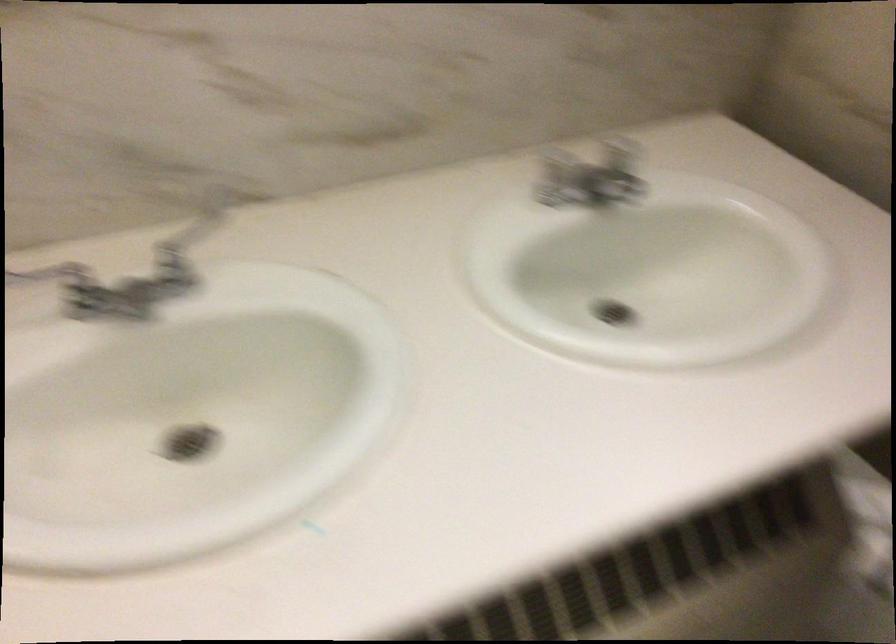
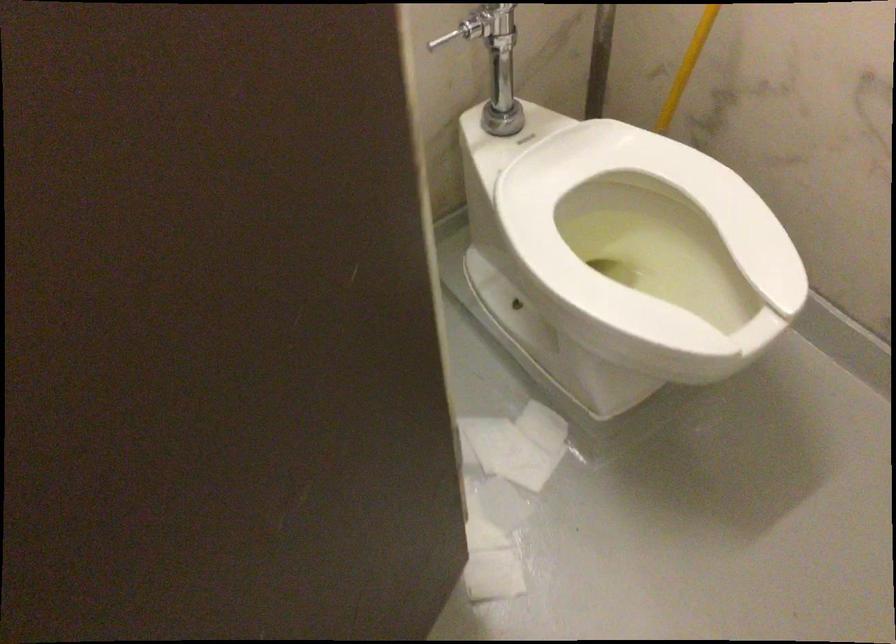
Question: The images are taken continuously from a first-person perspective. In which direction is your viewpoint rotating?

Choices:
 (A) Left
 (B) Right
 (C) Up
 (D) Down

Answer: (D)